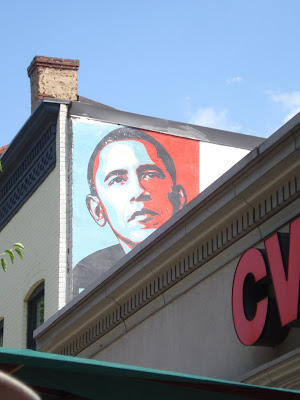
Identify the location of decorative trim. This screenshot has width=300, height=400. (39, 163), (133, 292).